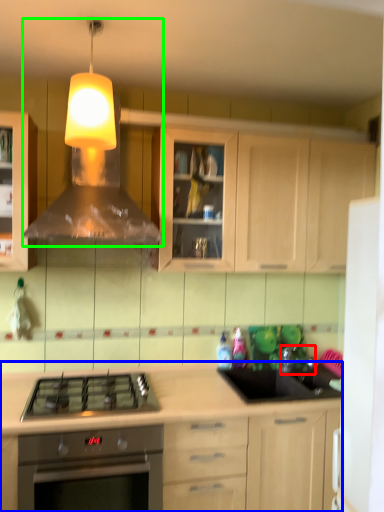
Question: Based on their relative distances, which object is nearer to faucet (highlighted by a red box)? Choose from cabinetry (highlighted by a blue box) and vent (highlighted by a green box).

Choices:
 (A) cabinetry
 (B) vent

Answer: (A)